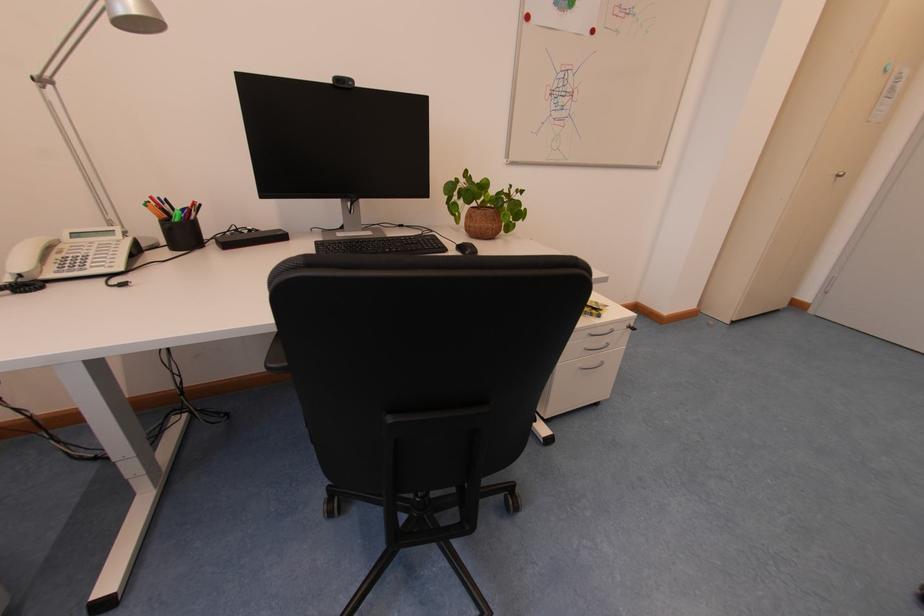
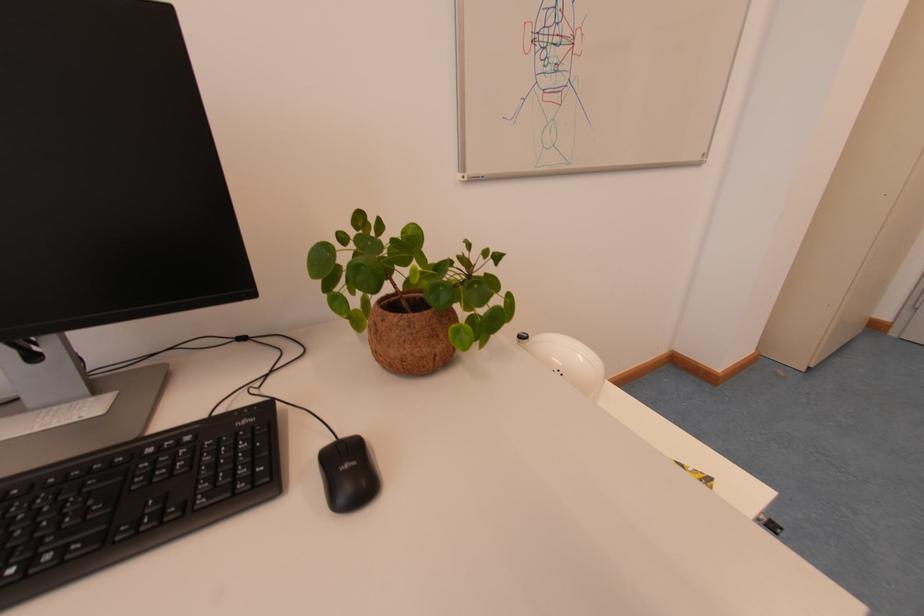
Question: Which direction would the cameraman need to move to produce the second image? Reply with the corresponding letter.

Choices:
 (A) Left
 (B) Right
 (C) Forward
 (D) Backward

Answer: (C)